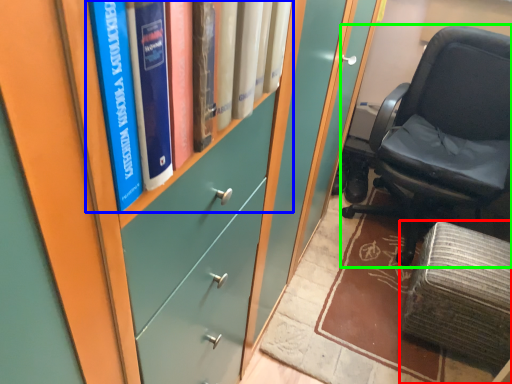
Question: Based on their relative distances, which object is farther from furniture (highlighted by a red box)? Choose from book (highlighted by a blue box) and chair (highlighted by a green box).

Choices:
 (A) book
 (B) chair

Answer: (A)